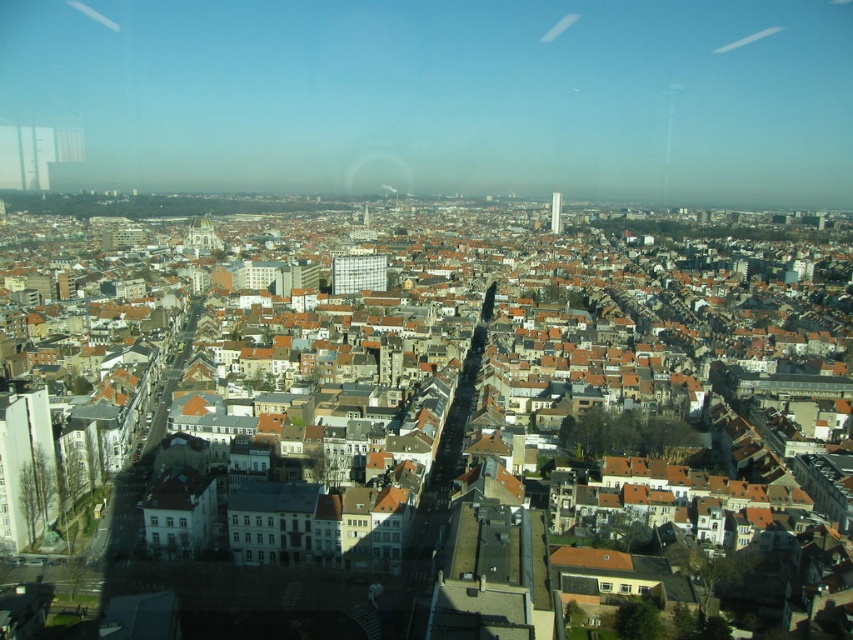
Question: Is white glass tower at center below transparent glass window at lower left?

Choices:
 (A) yes
 (B) no

Answer: (B)

Question: Estimate the real-world distances between objects in this image. Which object is farther from the matte glass building at center?

Choices:
 (A) white glass tower at center
 (B) transparent glass window at lower left

Answer: (B)

Question: Can you confirm if matte glass building at center is positioned below transparent glass window at lower left?

Choices:
 (A) yes
 (B) no

Answer: (B)

Question: Does white glass tower at center appear over transparent glass window at lower left?

Choices:
 (A) no
 (B) yes

Answer: (B)

Question: Which point is closer to the camera?

Choices:
 (A) matte glass building at center
 (B) white glass tower at center

Answer: (A)

Question: Which point is closer to the camera?

Choices:
 (A) (151, 522)
 (B) (355, 253)

Answer: (A)